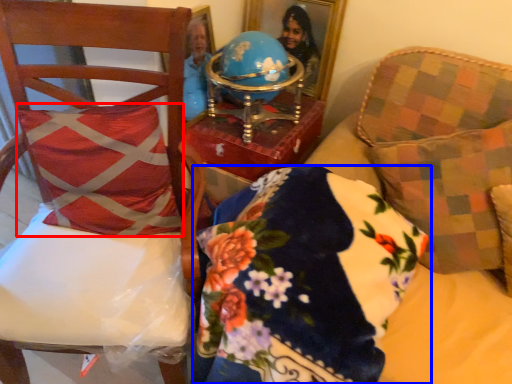
Question: Which object appears closest to the camera in this image, throw pillow (highlighted by a red box) or pillow (highlighted by a blue box)?

Choices:
 (A) throw pillow
 (B) pillow

Answer: (B)